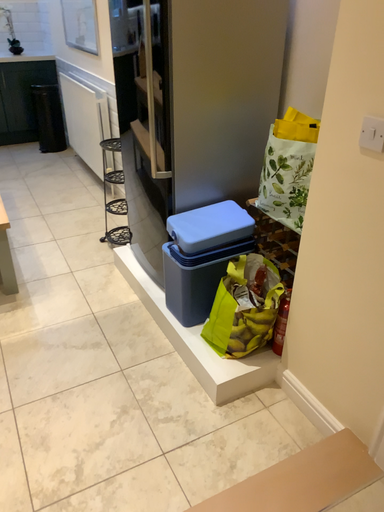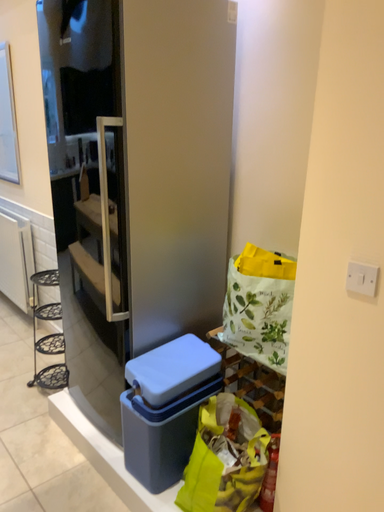
Question: How did the camera likely rotate when shooting the video?

Choices:
 (A) rotated downward
 (B) rotated upward

Answer: (B)